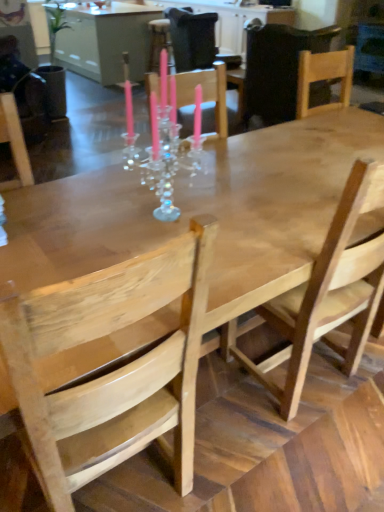
Question: From a real-world perspective, is wooden table at center above or below wooden chair at center, the fourth chair viewed from the front?

Choices:
 (A) below
 (B) above

Answer: (A)

Question: Is wooden table at center wider or thinner than wooden chair at center, the fourth chair viewed from the front?

Choices:
 (A) thin
 (B) wide

Answer: (B)

Question: Estimate the real-world distances between objects in this image. Which object is closer to the natural wood chair at left, placed as the fourth chair when sorted from back to front?

Choices:
 (A) natural wood chair at center, which ranks as the 3th chair in back-to-front order
 (B) wooden chair at center, the first chair viewed from the back
 (C) natural wood chair at upper right, the second chair from the back
 (D) wooden table at center

Answer: (A)

Question: Based on their relative distances, which object is farther from the wooden table at center?

Choices:
 (A) natural wood chair at center, the 2th chair from the front
 (B) wooden chair at center, the first chair viewed from the back
 (C) natural wood chair at left, placed as the first chair when sorted from front to back
 (D) natural wood chair at upper right, the second chair from the back

Answer: (C)